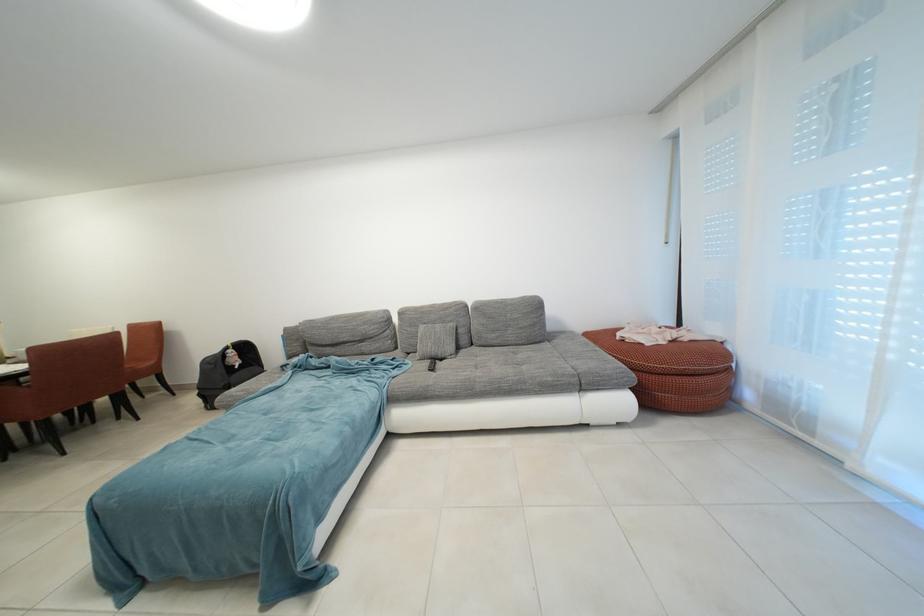
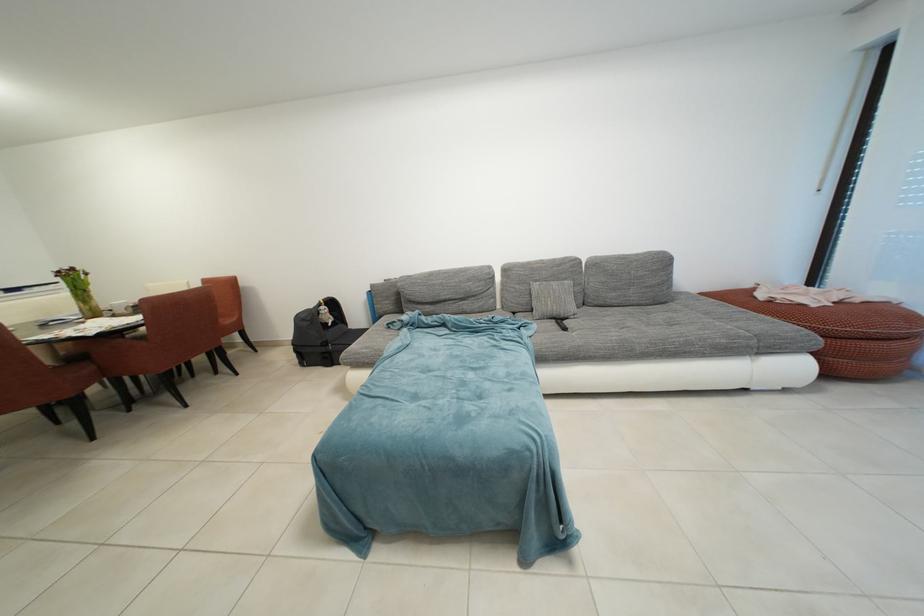
The point at (380, 342) is marked in the first image. Where is the corresponding point in the second image?

(482, 301)